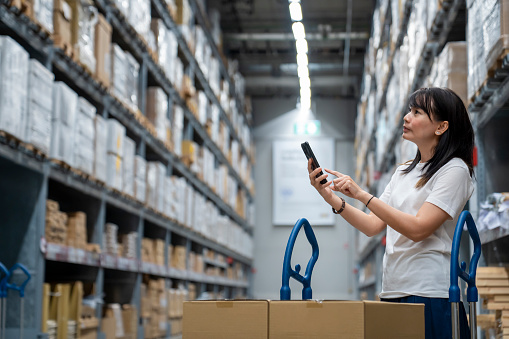
At what (x,y) coordinates should I click in order to perform the action: click on metal shelfing. Please return your answer as a coordinate pair (x, y). The image size is (509, 339). Looking at the image, I should click on (186, 54), (204, 34), (169, 87), (143, 138), (129, 207), (121, 265), (493, 114), (432, 61), (404, 35), (387, 23).